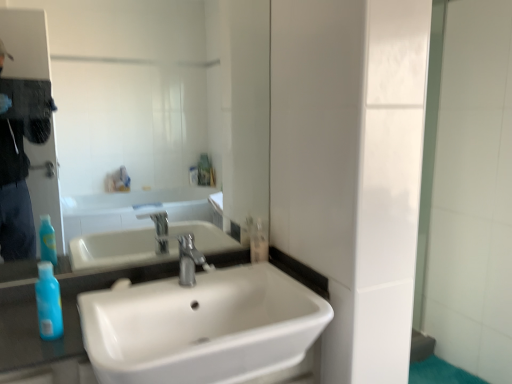
This screenshot has height=384, width=512. What are the coordinates of `vacant area that lies to the right of silver metallic faucet at center` in the screenshot? It's located at (248, 277).